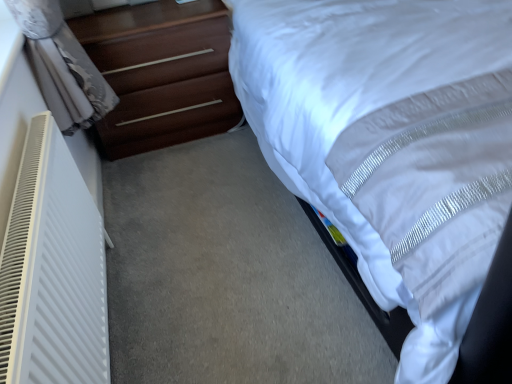
Describe the element at coordinates (161, 73) in the screenshot. I see `dark brown wood chest of drawers at left` at that location.

Image resolution: width=512 pixels, height=384 pixels. What are the coordinates of `white plastic radiator at left` in the screenshot? It's located at coord(52,270).

This screenshot has height=384, width=512. Find the location of `dark brown wood chest of drawers at left`. dark brown wood chest of drawers at left is located at coordinates (161, 73).

Considering the sizes of objects white plastic radiator at left and white satin bed at upper right in the image provided, who is bigger, white plastic radiator at left or white satin bed at upper right?

Bigger between the two is white satin bed at upper right.

Is point (7, 317) in front of point (396, 301)?

Yes, it is.

Between white plastic radiator at left and white satin bed at upper right, which one has more height?

white satin bed at upper right.

This screenshot has width=512, height=384. I want to click on bed positioned vertically above the white plastic radiator at left (from a real-world perspective), so click(364, 251).

Looking at this image, between white satin bed at upper right and white plastic radiator at left, which one has larger size?

With larger size is white satin bed at upper right.

Is white satin bed at upper right positioned beyond the bounds of white plastic radiator at left?

Yes.

Is white satin bed at upper right to the right of white plastic radiator at left from the viewer's perspective?

Yes, white satin bed at upper right is to the right of white plastic radiator at left.

Looking at this image, considering the sizes of objects white satin bed at upper right and dark brown wood chest of drawers at left in the image provided, who is thinner, white satin bed at upper right or dark brown wood chest of drawers at left?

dark brown wood chest of drawers at left.

Is point (329, 211) closer to camera compared to point (168, 17)?

Yes, it is.

In the image, is white satin bed at upper right positioned in front of or behind dark brown wood chest of drawers at left?

Visually, white satin bed at upper right is located in front of dark brown wood chest of drawers at left.

Is white satin bed at upper right turned away from dark brown wood chest of drawers at left?

That's not correct — white satin bed at upper right is not looking away from dark brown wood chest of drawers at left.

Is white plastic radiator at left aimed at dark brown wood chest of drawers at left?

No, white plastic radiator at left is not turned towards dark brown wood chest of drawers at left.

Is white plastic radiator at left not within dark brown wood chest of drawers at left?

Indeed, white plastic radiator at left is completely outside dark brown wood chest of drawers at left.

This screenshot has width=512, height=384. What are the coordinates of `air conditioner in front of the dark brown wood chest of drawers at left` in the screenshot? It's located at (52, 270).

Considering the sizes of white plastic radiator at left and dark brown wood chest of drawers at left in the image, is white plastic radiator at left taller or shorter than dark brown wood chest of drawers at left?

white plastic radiator at left is taller than dark brown wood chest of drawers at left.

Which of these two, dark brown wood chest of drawers at left or white satin bed at upper right, stands shorter?

With less height is dark brown wood chest of drawers at left.

Can you confirm if dark brown wood chest of drawers at left is wider than white satin bed at upper right?

Incorrect, the width of dark brown wood chest of drawers at left does not surpass that of white satin bed at upper right.

Based on the photo, is dark brown wood chest of drawers at left outside of white satin bed at upper right?

Absolutely, dark brown wood chest of drawers at left is external to white satin bed at upper right.

Considering the positions of objects dark brown wood chest of drawers at left and white satin bed at upper right in the image provided, who is behind, dark brown wood chest of drawers at left or white satin bed at upper right?

dark brown wood chest of drawers at left is behind.

Is point (156, 109) positioned after point (19, 209)?

That is True.

From the image's perspective, does dark brown wood chest of drawers at left appear higher than white plastic radiator at left?

Indeed, from the image's perspective, dark brown wood chest of drawers at left is shown above white plastic radiator at left.

How many degrees apart are the facing directions of dark brown wood chest of drawers at left and white plastic radiator at left?

The angular difference between dark brown wood chest of drawers at left and white plastic radiator at left is 90 degrees.

The image size is (512, 384). What are the coordinates of `air conditioner that appears below the dark brown wood chest of drawers at left (from the image's perspective)` in the screenshot? It's located at (52, 270).

Locate an element on the screen. The height and width of the screenshot is (384, 512). air conditioner on the left of white satin bed at upper right is located at coordinates (52, 270).

The image size is (512, 384). I want to click on bed above the white plastic radiator at left (from the image's perspective), so click(x=364, y=251).

From the image, which object appears to be nearer to dark brown wood chest of drawers at left, white satin bed at upper right or white plastic radiator at left?

white satin bed at upper right is closer to dark brown wood chest of drawers at left.

From the image, which object appears to be farther from white satin bed at upper right, dark brown wood chest of drawers at left or white plastic radiator at left?

The object further to white satin bed at upper right is white plastic radiator at left.

From the image, which object appears to be farther from white satin bed at upper right, white plastic radiator at left or dark brown wood chest of drawers at left?

white plastic radiator at left is positioned further to the anchor white satin bed at upper right.

When comparing their distances from dark brown wood chest of drawers at left, does white plastic radiator at left or white satin bed at upper right seem closer?

white satin bed at upper right lies closer to dark brown wood chest of drawers at left than the other object.

From the image, which object appears to be nearer to white plastic radiator at left, white satin bed at upper right or dark brown wood chest of drawers at left?

Based on the image, white satin bed at upper right appears to be nearer to white plastic radiator at left.

Considering their positions, is dark brown wood chest of drawers at left positioned further to white plastic radiator at left than white satin bed at upper right?

Among the two, dark brown wood chest of drawers at left is located further to white plastic radiator at left.

At what (x,y) coordinates should I click in order to perform the action: click on air conditioner between dark brown wood chest of drawers at left and white satin bed at upper right in the horizontal direction. Please return your answer as a coordinate pair (x, y). This screenshot has height=384, width=512. Looking at the image, I should click on (52, 270).